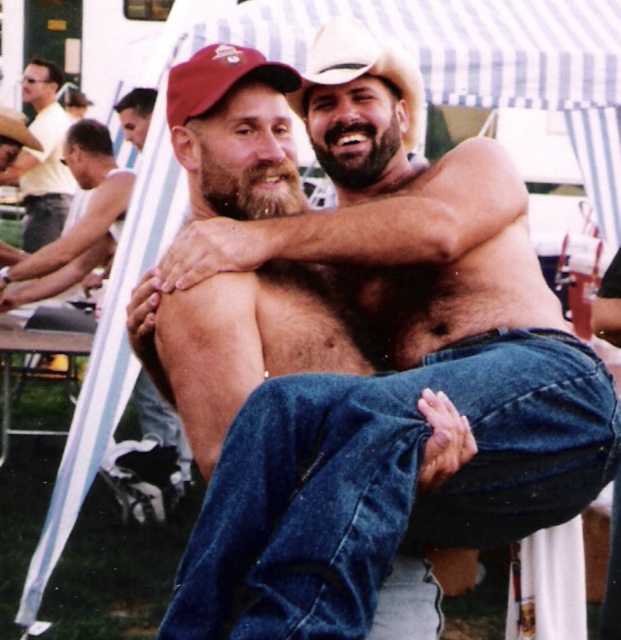
Between denim jeans at center and brown hairy chest at left, which one is positioned higher?

Positioned higher is brown hairy chest at left.

Is denim jeans at center below brown hairy chest at left?

Yes.

Who is more forward, (263, 454) or (101, 164)?

Positioned in front is point (263, 454).

At what (x,y) coordinates should I click in order to perform the action: click on denim jeans at center. Please return your answer as a coordinate pair (x, y). Image resolution: width=621 pixels, height=640 pixels. Looking at the image, I should click on (386, 483).

Is brown hairy chest at left closer to camera compared to matte yellow shirt at upper left?

Yes, brown hairy chest at left is in front of matte yellow shirt at upper left.

Locate an element on the screen. The width and height of the screenshot is (621, 640). brown hairy chest at left is located at coordinates (75, 221).

Image resolution: width=621 pixels, height=640 pixels. Identify the location of brown hairy chest at left. (75, 221).

Locate an element on the screen. brown hairy chest at left is located at coordinates (75, 221).

Who is shorter, denim jeans at center or matte yellow shirt at upper left?

denim jeans at center is shorter.

Is denim jeans at center smaller than matte yellow shirt at upper left?

Correct, denim jeans at center occupies less space than matte yellow shirt at upper left.

What do you see at coordinates (386, 483) in the screenshot? The width and height of the screenshot is (621, 640). I see `denim jeans at center` at bounding box center [386, 483].

You are a GUI agent. You are given a task and a screenshot of the screen. Output one action in this format:
    pyautogui.click(x=<x>, y=<y>)
    Task: Click on the denim jeans at center
    The width and height of the screenshot is (621, 640).
    Given the screenshot: What is the action you would take?
    pyautogui.click(x=386, y=483)